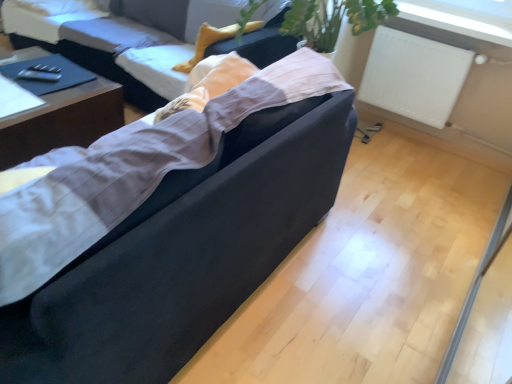
What are the coordinates of `empty space that is ontop of dark wood table at left (from a real-world perspective)` in the screenshot? It's located at (38, 79).